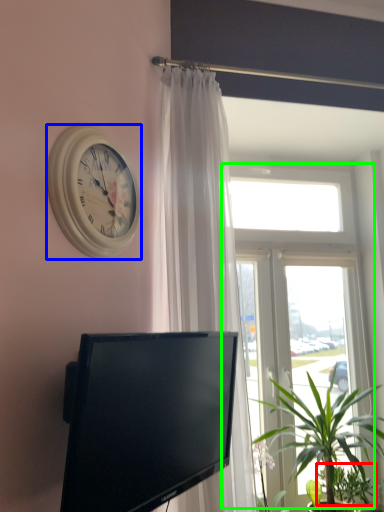
Question: Based on their relative distances, which object is farther from plant (highlighted by a red box)? Choose from wall clock (highlighted by a blue box) and window (highlighted by a green box).

Choices:
 (A) wall clock
 (B) window

Answer: (A)